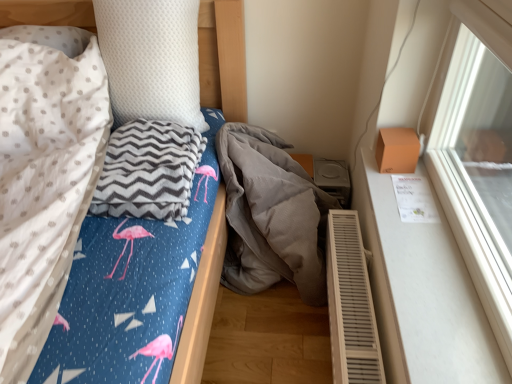
Question: Should I look upward or downward to see gray corduroy blanket at center, the 1th material viewed from the right?

Choices:
 (A) down
 (B) up

Answer: (A)

Question: Is gray chevron blanket at left, which ranks as the 1th material in left-to-right order, oriented towards gray corduroy blanket at center, which is counted as the 2th material, starting from the left?

Choices:
 (A) yes
 (B) no

Answer: (B)

Question: Can you confirm if gray chevron blanket at left, which ranks as the 1th material in left-to-right order, is positioned to the right of gray corduroy blanket at center, the 1th material viewed from the right?

Choices:
 (A) no
 (B) yes

Answer: (A)

Question: From the image's perspective, is gray chevron blanket at left, which ranks as the 1th material in left-to-right order, located beneath gray corduroy blanket at center, the 1th material viewed from the right?

Choices:
 (A) no
 (B) yes

Answer: (A)

Question: Can you confirm if gray chevron blanket at left, which is the 2th material from right to left, is smaller than gray corduroy blanket at center, which is counted as the 2th material, starting from the left?

Choices:
 (A) yes
 (B) no

Answer: (A)

Question: Is gray corduroy blanket at center, the 1th material viewed from the right, surrounded by gray chevron blanket at left, which is the 2th material from right to left?

Choices:
 (A) no
 (B) yes

Answer: (A)

Question: From a real-world perspective, is gray chevron blanket at left, which is the 2th material from right to left, located beneath gray corduroy blanket at center, which is counted as the 2th material, starting from the left?

Choices:
 (A) no
 (B) yes

Answer: (A)

Question: Does gray chevron blanket at left, which ranks as the 1th material in left-to-right order, have a smaller size compared to white dotted pillow at upper left?

Choices:
 (A) no
 (B) yes

Answer: (B)

Question: Is gray chevron blanket at left, which is the 2th material from right to left, bigger than white dotted pillow at upper left?

Choices:
 (A) no
 (B) yes

Answer: (A)

Question: Can you confirm if gray chevron blanket at left, which ranks as the 1th material in left-to-right order, is positioned to the right of white dotted pillow at upper left?

Choices:
 (A) no
 (B) yes

Answer: (B)

Question: From the image's perspective, does gray chevron blanket at left, which is the 2th material from right to left, appear lower than white dotted pillow at upper left?

Choices:
 (A) yes
 (B) no

Answer: (A)

Question: Is gray chevron blanket at left, which ranks as the 1th material in left-to-right order, to the left of white dotted pillow at upper left from the viewer's perspective?

Choices:
 (A) no
 (B) yes

Answer: (A)

Question: From the image's perspective, is gray chevron blanket at left, which is the 2th material from right to left, on top of white dotted pillow at upper left?

Choices:
 (A) no
 (B) yes

Answer: (A)

Question: Can you confirm if gray chevron blanket at left, which ranks as the 1th material in left-to-right order, is shorter than white matte window sill at right?

Choices:
 (A) yes
 (B) no

Answer: (B)